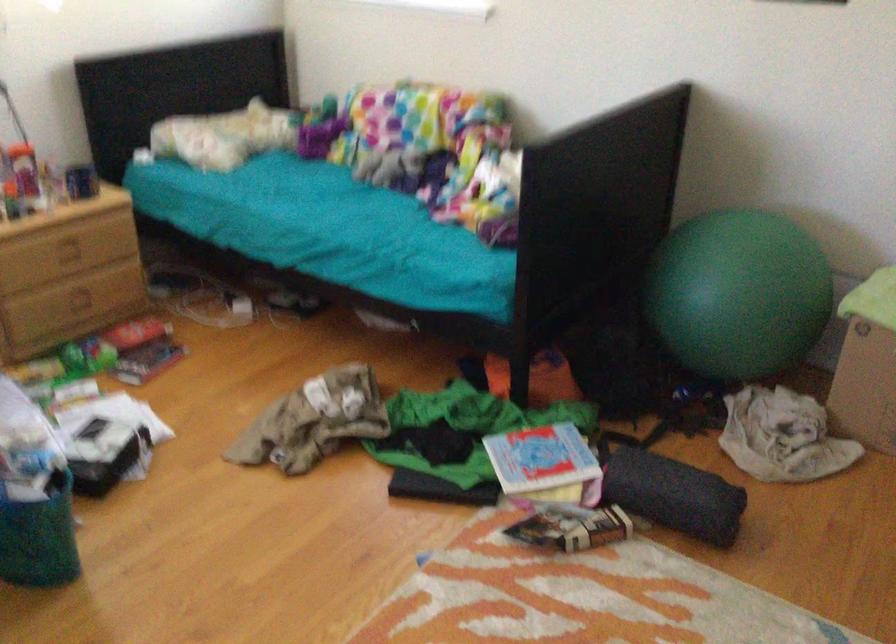
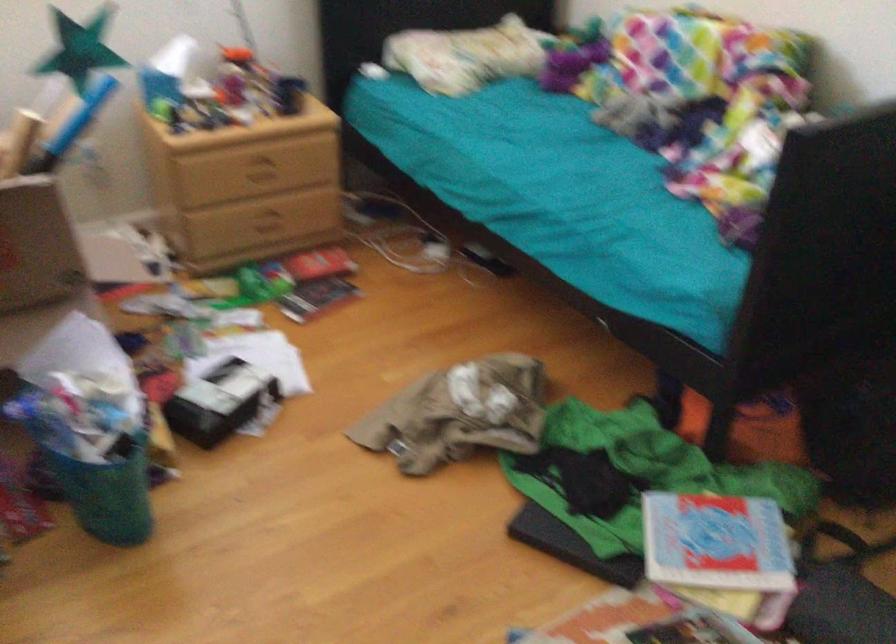
Where in the second image is the point corresponding to pixel 288 303 from the first image?

(481, 259)